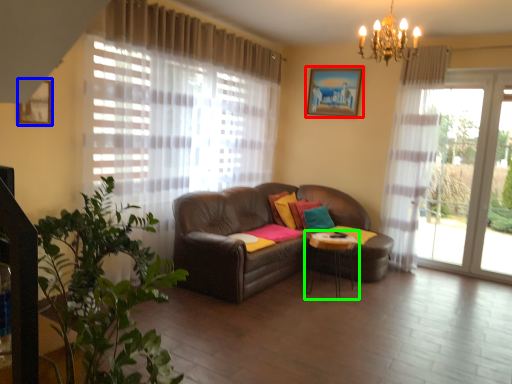
Question: Which object is positioned farthest from picture frame (highlighted by a red box)? Select from picture frame (highlighted by a blue box) and table (highlighted by a green box).

Choices:
 (A) picture frame
 (B) table

Answer: (A)